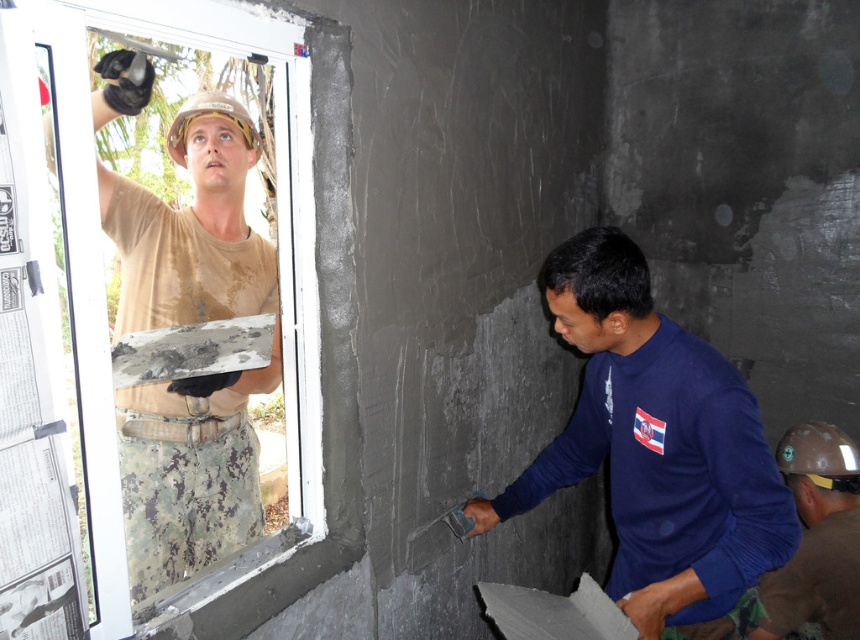
Question: Considering the real-world distances, which object is farthest from the blue matte t-shirt at center?

Choices:
 (A) matte blue shirt at lower right
 (B) white matte window at upper left

Answer: (B)

Question: Which point is farther to the camera?

Choices:
 (A) (330, 205)
 (B) (756, 456)
 (C) (832, 547)

Answer: (C)

Question: Which object appears farthest from the camera in this image?

Choices:
 (A) blue matte t-shirt at center
 (B) white matte window at upper left
 (C) matte blue shirt at lower right

Answer: (C)

Question: Does white matte window at upper left have a lesser width compared to matte blue shirt at lower right?

Choices:
 (A) no
 (B) yes

Answer: (A)

Question: Is white matte window at upper left to the left of blue matte t-shirt at center from the viewer's perspective?

Choices:
 (A) no
 (B) yes

Answer: (B)

Question: Considering the relative positions of white matte window at upper left and matte blue shirt at lower right in the image provided, where is white matte window at upper left located with respect to matte blue shirt at lower right?

Choices:
 (A) below
 (B) above

Answer: (B)